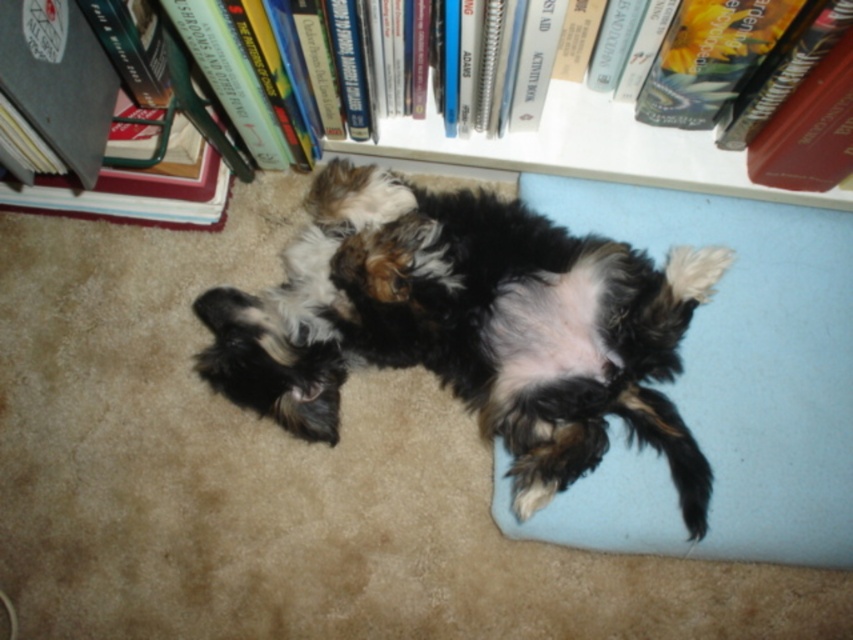
Who is lower down, white plastic bookcase at upper center or hardcover book at left?

white plastic bookcase at upper center

Does point (782, 193) come in front of point (86, 65)?

No, (782, 193) is behind (86, 65).

Find the location of a particular element. The image size is (853, 640). white plastic bookcase at upper center is located at coordinates pos(582,148).

What do you see at coordinates (469, 326) in the screenshot? I see `fluffy fur dog at center` at bounding box center [469, 326].

Who is positioned more to the left, fluffy fur dog at center or hardcover book at left?

Positioned to the left is hardcover book at left.

Which is behind, point (587, 416) or point (113, 97)?

The point (113, 97) is behind.

Locate an element on the screen. This screenshot has height=640, width=853. fluffy fur dog at center is located at coordinates (469, 326).

Is fluffy fur dog at center above light blue fabric dog bed at lower right?

Correct, fluffy fur dog at center is located above light blue fabric dog bed at lower right.

Is point (447, 278) positioned in front of point (660, 209)?

Yes.

Which is in front, point (628, 284) or point (799, 464)?

Point (628, 284) is more forward.

Identify the location of fluffy fur dog at center. The image size is (853, 640). (469, 326).